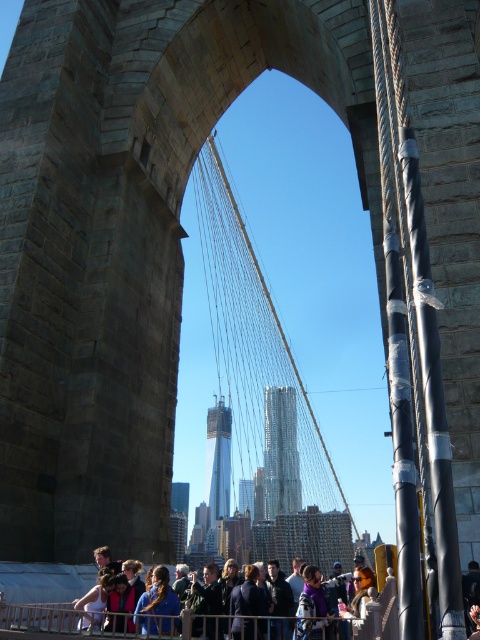
What do you see at coordinates (156, 600) in the screenshot?
I see `blue fabric at center` at bounding box center [156, 600].

Is blue fabric at center closer to camera compared to dark gray jacket at center?

No, it is behind dark gray jacket at center.

Image resolution: width=480 pixels, height=640 pixels. What do you see at coordinates (156, 600) in the screenshot? I see `blue fabric at center` at bounding box center [156, 600].

This screenshot has width=480, height=640. Find the location of `blue fabric at center`. blue fabric at center is located at coordinates (156, 600).

Between purple fabric at center and dark blue jacket at center, which one appears on the right side from the viewer's perspective?

Positioned to the right is purple fabric at center.

What do you see at coordinates (313, 608) in the screenshot? This screenshot has width=480, height=640. I see `purple fabric at center` at bounding box center [313, 608].

Locate an element on the screen. purple fabric at center is located at coordinates (313, 608).

Can you confirm if blue fabric crowd at lower center is bigger than blue fabric at center?

Correct, blue fabric crowd at lower center is larger in size than blue fabric at center.

Is blue fabric crowd at lower center closer to the viewer compared to blue fabric at center?

That is True.

Between point (207, 588) and point (159, 582), which one is positioned in front?

Positioned in front is point (159, 582).

I want to click on blue fabric crowd at lower center, so click(x=179, y=618).